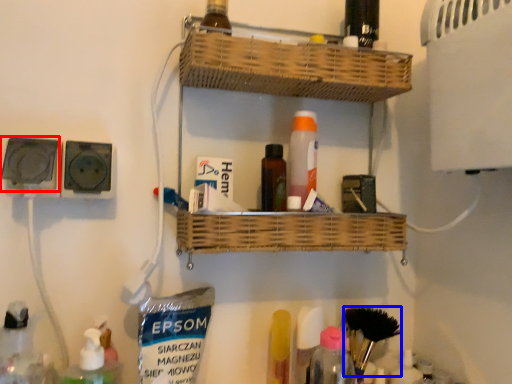
Question: Which object is further to the camera taking this photo, electric outlet (highlighted by a red box) or brush (highlighted by a blue box)?

Choices:
 (A) electric outlet
 (B) brush

Answer: (B)